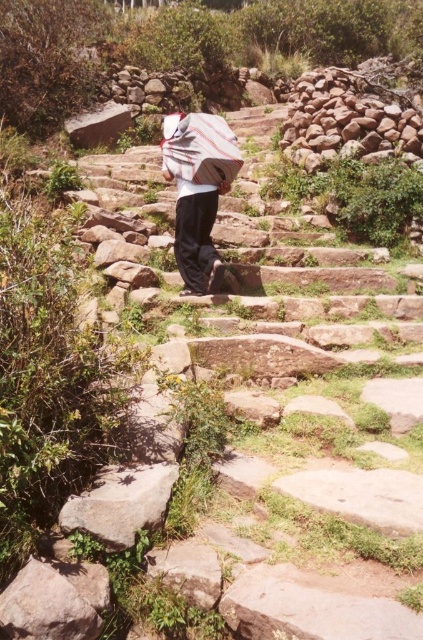
Question: Which is farther from the white striped shirt at center?

Choices:
 (A) white striped fabric umbrella at center
 (B) gray rough rock at lower left

Answer: (B)

Question: Which object is farther from the camera taking this photo?

Choices:
 (A) white striped fabric umbrella at center
 (B) white striped shirt at center

Answer: (A)

Question: Which of the following is the closest to the observer?

Choices:
 (A) (414, 132)
 (B) (181, 163)

Answer: (B)

Question: Does smooth stone wall at upper right have a lesser width compared to white striped shirt at center?

Choices:
 (A) yes
 (B) no

Answer: (B)

Question: Is the position of smooth stone wall at upper right more distant than that of white striped fabric umbrella at center?

Choices:
 (A) no
 (B) yes

Answer: (B)

Question: Can you confirm if smooth stone wall at upper right is positioned to the right of white striped fabric umbrella at center?

Choices:
 (A) yes
 (B) no

Answer: (A)